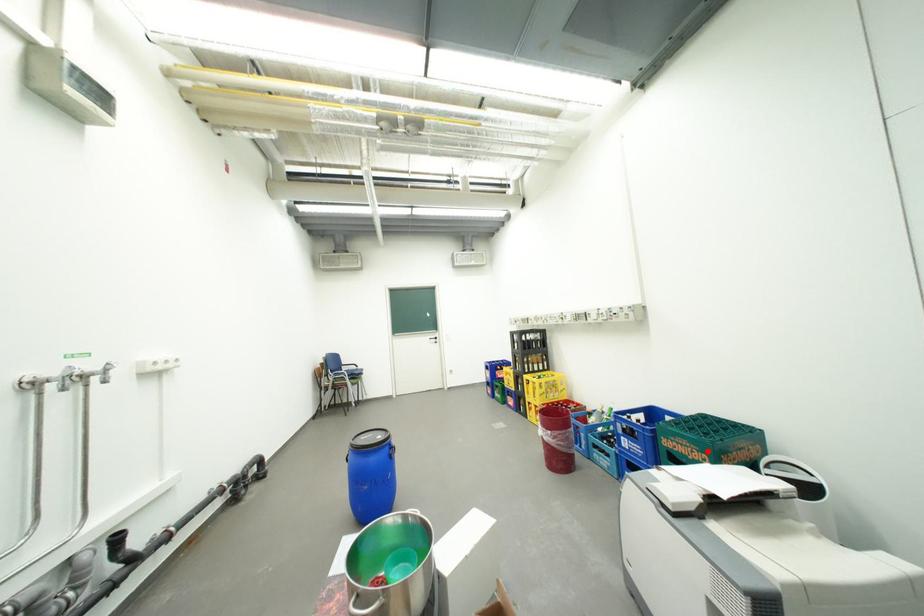
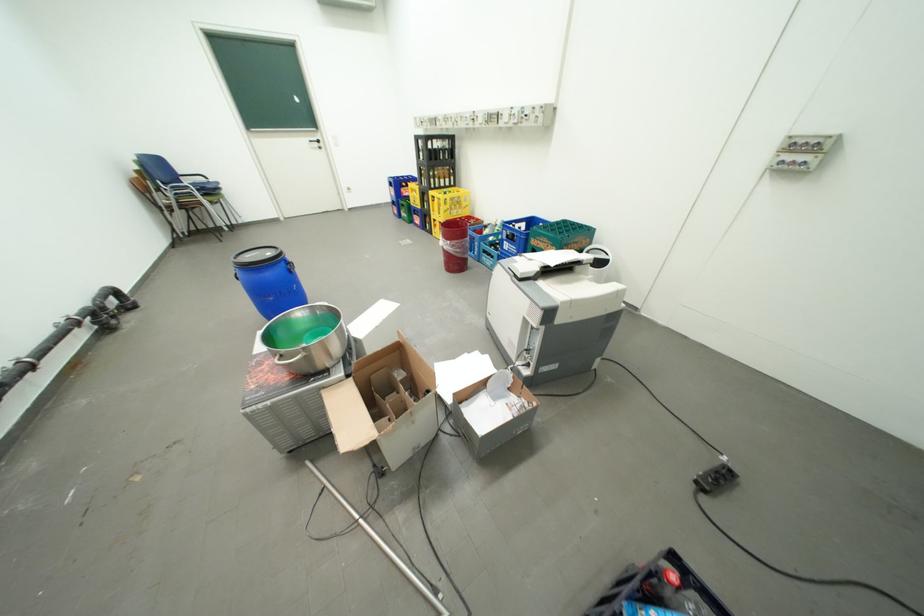
Question: A red point is marked in image1. In image2, is the corresponding 3D point closer to the camera or farther? Reply with the corresponding letter.

Choices:
 (A) The corresponding 3D point is closer.
 (B) The corresponding 3D point is farther.

Answer: (B)